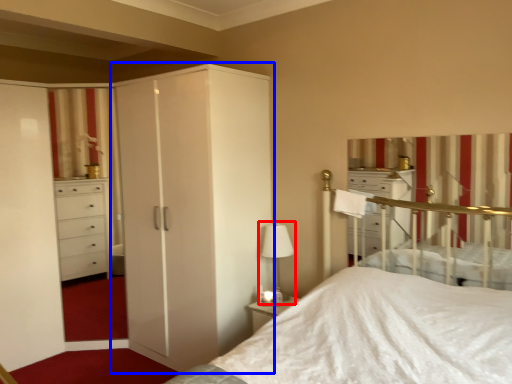
Question: Which object appears farthest to the camera in this image, table lamp (highlighted by a red box) or cupboard (highlighted by a blue box)?

Choices:
 (A) table lamp
 (B) cupboard

Answer: (A)